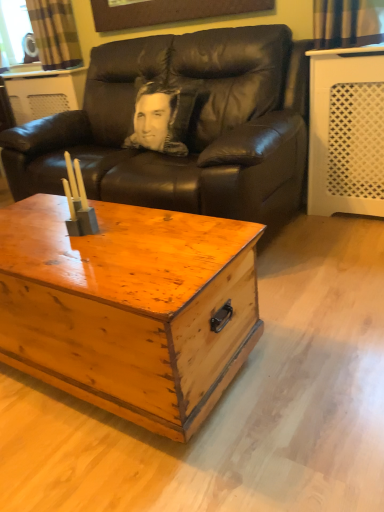
I want to click on free space above wooden chest at center (from a real-world perspective), so click(73, 244).